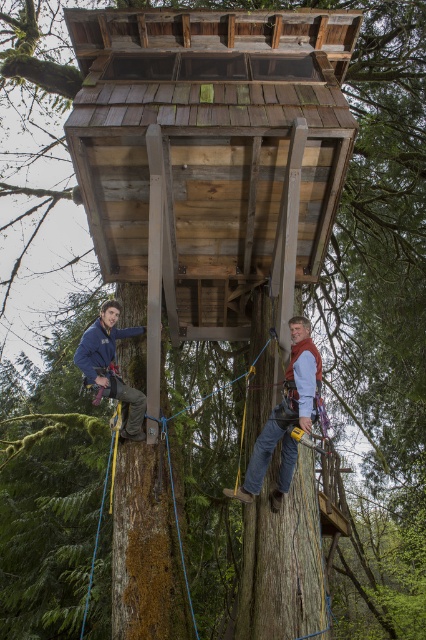
Does green mossy bark at lower left have a larger size compared to matte blue jacket at left?

Yes, green mossy bark at lower left is bigger than matte blue jacket at left.

Which is below, green mossy bark at lower left or matte blue jacket at left?

green mossy bark at lower left is below.

You are a GUI agent. You are given a task and a screenshot of the screen. Output one action in this format:
    pyautogui.click(x=<x>, y=<y>)
    Task: Click on the green mossy bark at lower left
    This screenshot has width=426, height=640.
    Given the screenshot: What is the action you would take?
    click(x=146, y=550)

Is wooden platform at center wider than green mossy bark at lower left?

Yes, wooden platform at center is wider than green mossy bark at lower left.

Can you confirm if wooden platform at center is positioned below green mossy bark at lower left?

Actually, wooden platform at center is above green mossy bark at lower left.

Which is in front, point (121, 177) or point (180, 595)?

Point (180, 595)

The height and width of the screenshot is (640, 426). In order to click on wooden platform at center in this screenshot , I will do `click(210, 148)`.

Who is more distant from viewer, (x=238, y=170) or (x=288, y=449)?

Point (x=238, y=170)

Is point (259, 74) closer to camera compared to point (301, 348)?

No, it is not.

Which is in front, point (238, 93) or point (307, 320)?

Positioned in front is point (307, 320).

Identify the location of wooden platform at center. (210, 148).